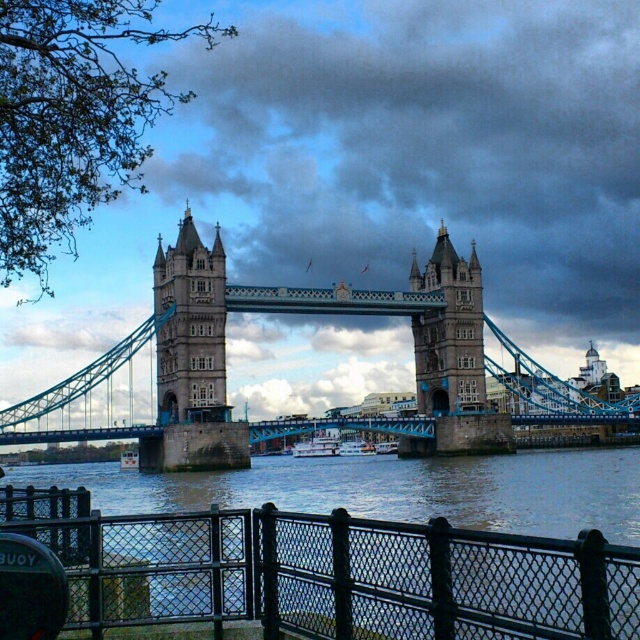
You are standing on the riverbank and want to cross to the other side. You notice the black metal fence at lower center and the stone stonework tower at center. Which structure is shorter, and could it be a better path to cross?

The black metal fence at lower center is shorter than the stone stonework tower at center. Since it is lower, it might be easier to climb over or navigate around to cross the river.

You are standing at the point of observation and want to locate the black metal fence at lower center. What are the coordinates of this object?

The coordinates of the black metal fence at lower center are at point (326, 572).

You are standing at the edge of the river and want to cross to the other side. You see the black metal fence at lower center and the teal stone suspension bridge at center. Which structure is wider and should you use to cross?

The teal stone suspension bridge at center is wider than the black metal fence at lower center, so you should use the teal stone suspension bridge at center to cross safely.